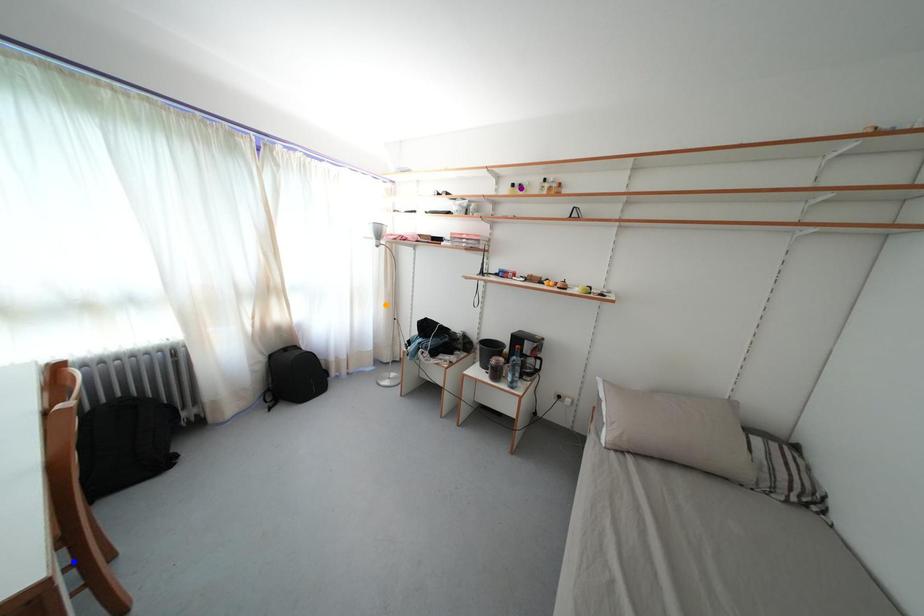
Order these from nearest to farthest:
blue point, purple point, orange point

blue point < purple point < orange point